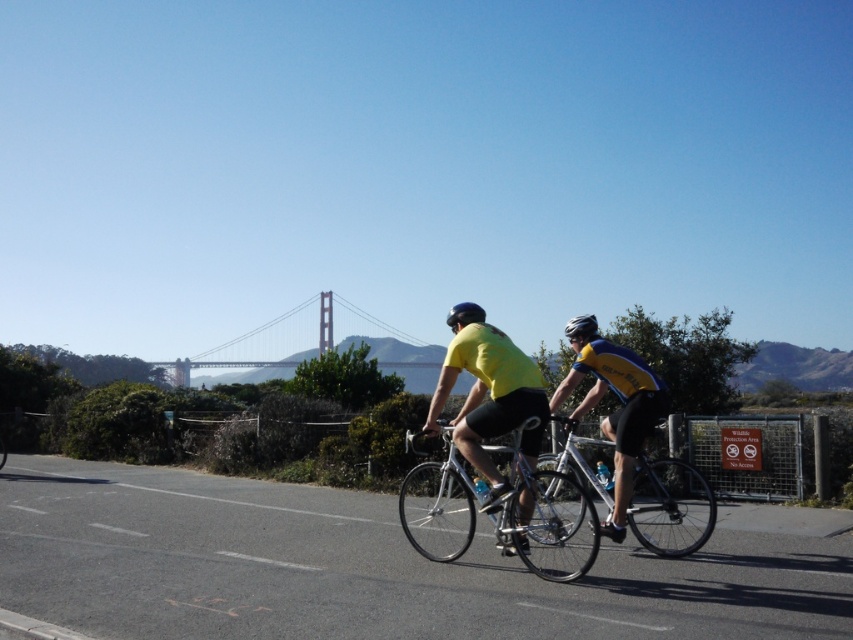
Question: Estimate the real-world distances between objects in this image. Which object is closer to the shiny silver bicycle at center?

Choices:
 (A) yellow/blue jersey at center
 (B) silver metallic bicycle at center

Answer: (A)

Question: Does black matte helmet at center have a lesser width compared to matte black helmet at center?

Choices:
 (A) no
 (B) yes

Answer: (A)

Question: Can you confirm if metallic gray bridge at center is bigger than black matte helmet at center?

Choices:
 (A) yes
 (B) no

Answer: (A)

Question: Among these objects, which one is nearest to the camera?

Choices:
 (A) silver metallic bicycle at center
 (B) shiny silver bicycle at center
 (C) black matte helmet at center

Answer: (B)

Question: Does shiny silver bicycle at center appear over black matte helmet at center?

Choices:
 (A) yes
 (B) no

Answer: (B)

Question: Which of these objects is positioned farthest from the shiny silver bicycle at center?

Choices:
 (A) yellow matte shirt at center
 (B) black matte helmet at center
 (C) yellow/blue jersey at center

Answer: (B)